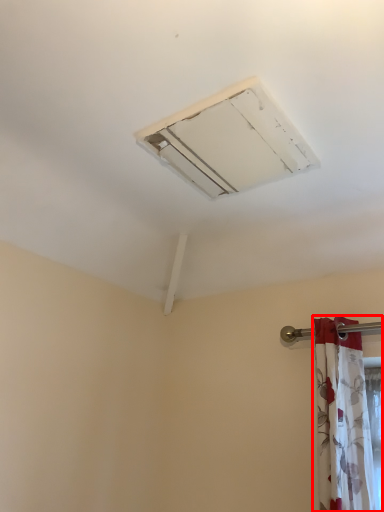
Question: Observing the image, what is the correct spatial positioning of curtain (annotated by the red box) in reference to air conditioning?

Choices:
 (A) left
 (B) right

Answer: (B)